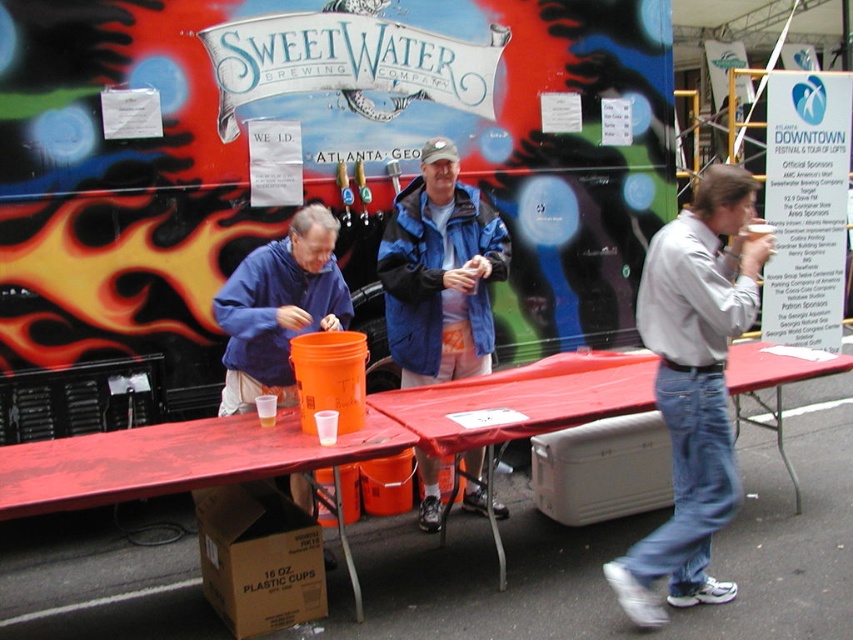
Question: Which of the following is the closest to the observer?

Choices:
 (A) red plastic table at center
 (B) blue fleece jacket at center

Answer: (A)

Question: Based on their relative distances, which object is nearer to the red plastic table at center?

Choices:
 (A) blue fleece jacket at center
 (B) light gray shirt at right
 (C) blue fleece jacket at left

Answer: (A)

Question: Which of the following is the closest to the observer?

Choices:
 (A) (173, 445)
 (B) (300, 262)
 (C) (664, 262)

Answer: (C)

Question: Does blue fleece jacket at center have a larger size compared to orange plastic bucket at lower left?

Choices:
 (A) yes
 (B) no

Answer: (B)

Question: Can you confirm if orange plastic bucket at lower left is positioned below blue fleece jacket at left?

Choices:
 (A) no
 (B) yes

Answer: (B)

Question: Does orange plastic bucket at lower left have a greater width compared to red plastic table at center?

Choices:
 (A) yes
 (B) no

Answer: (A)